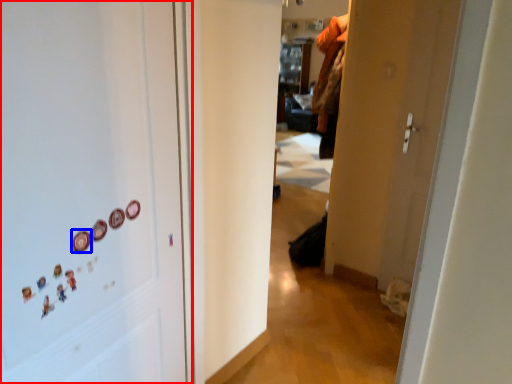
Question: Which object appears farthest to the camera in this image, door (highlighted by a red box) or button (highlighted by a blue box)?

Choices:
 (A) door
 (B) button

Answer: (B)